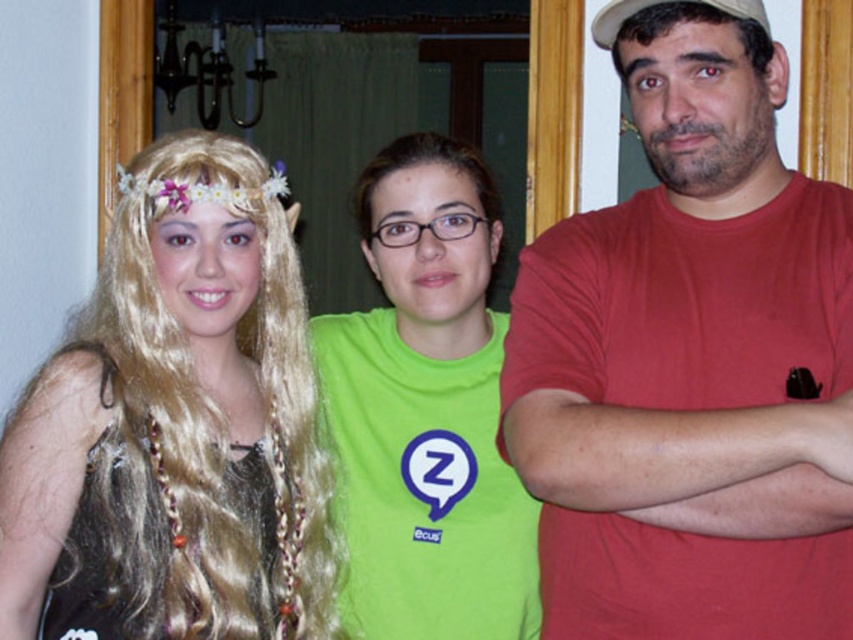
You are standing in the room and want to reach both points. Which point, point (x=257, y=385) or point (x=498, y=625), should you go to first if you want to reach the one closer to you first?

You should go to point (x=257, y=385) first because it is closer to you than point (x=498, y=625).